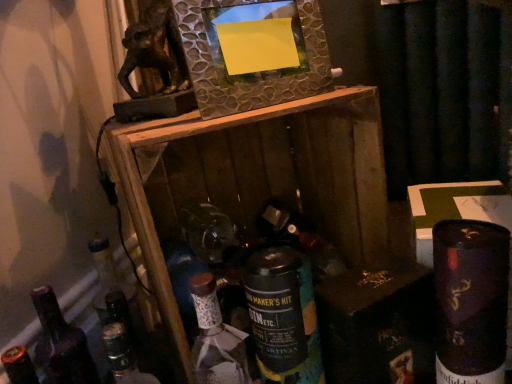
Question: Considering the relative sizes of shiny dark blue can at lower right, which is the first bottle in right-to-left order, and metallic textured frame at upper center in the image provided, is shiny dark blue can at lower right, which is the first bottle in right-to-left order, thinner than metallic textured frame at upper center?

Choices:
 (A) yes
 (B) no

Answer: (B)

Question: Could metallic textured frame at upper center be considered to be inside shiny dark blue can at lower right, marked as the 4th bottle in a left-to-right arrangement?

Choices:
 (A) yes
 (B) no

Answer: (B)

Question: From a real-world perspective, is shiny dark blue can at lower right, marked as the 4th bottle in a left-to-right arrangement, on metallic textured frame at upper center?

Choices:
 (A) no
 (B) yes

Answer: (A)

Question: Is shiny dark blue can at lower right, which is the first bottle in right-to-left order, closer to camera compared to metallic textured frame at upper center?

Choices:
 (A) yes
 (B) no

Answer: (A)

Question: Is shiny dark blue can at lower right, which is the first bottle in right-to-left order, bigger than metallic textured frame at upper center?

Choices:
 (A) yes
 (B) no

Answer: (A)

Question: Considering the relative sizes of shiny dark blue can at lower right, marked as the 4th bottle in a left-to-right arrangement, and metallic textured frame at upper center in the image provided, is shiny dark blue can at lower right, marked as the 4th bottle in a left-to-right arrangement, smaller than metallic textured frame at upper center?

Choices:
 (A) yes
 (B) no

Answer: (B)

Question: Considering the relative sizes of matte glass wine bottle at center and white ceramic bottle at center, acting as the 3th bottle starting from the right, in the image provided, is matte glass wine bottle at center smaller than white ceramic bottle at center, acting as the 3th bottle starting from the right,?

Choices:
 (A) yes
 (B) no

Answer: (A)

Question: Is matte glass wine bottle at center shorter than white ceramic bottle at center, acting as the 3th bottle starting from the right?

Choices:
 (A) yes
 (B) no

Answer: (A)

Question: From a real-world perspective, is matte glass wine bottle at center over white ceramic bottle at center, acting as the 3th bottle starting from the right?

Choices:
 (A) no
 (B) yes

Answer: (B)

Question: Is matte glass wine bottle at center facing away from white ceramic bottle at center, acting as the 3th bottle starting from the right?

Choices:
 (A) no
 (B) yes

Answer: (A)

Question: Is matte glass wine bottle at center taller than white ceramic bottle at center, which ranks as the second bottle in left-to-right order?

Choices:
 (A) yes
 (B) no

Answer: (B)

Question: Is white ceramic bottle at center, acting as the 3th bottle starting from the right, surrounded by matte glass wine bottle at center?

Choices:
 (A) yes
 (B) no

Answer: (B)

Question: Does metallic textured frame at upper center appear on the right side of shiny dark blue can at lower right, which is the first bottle in right-to-left order?

Choices:
 (A) yes
 (B) no

Answer: (B)